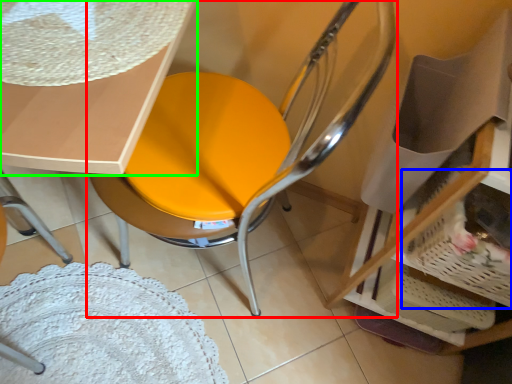
Question: Which object is the farthest from chair (highlighted by a red box)? Choose among these: basket (highlighted by a blue box) or table (highlighted by a green box).

Choices:
 (A) basket
 (B) table

Answer: (A)